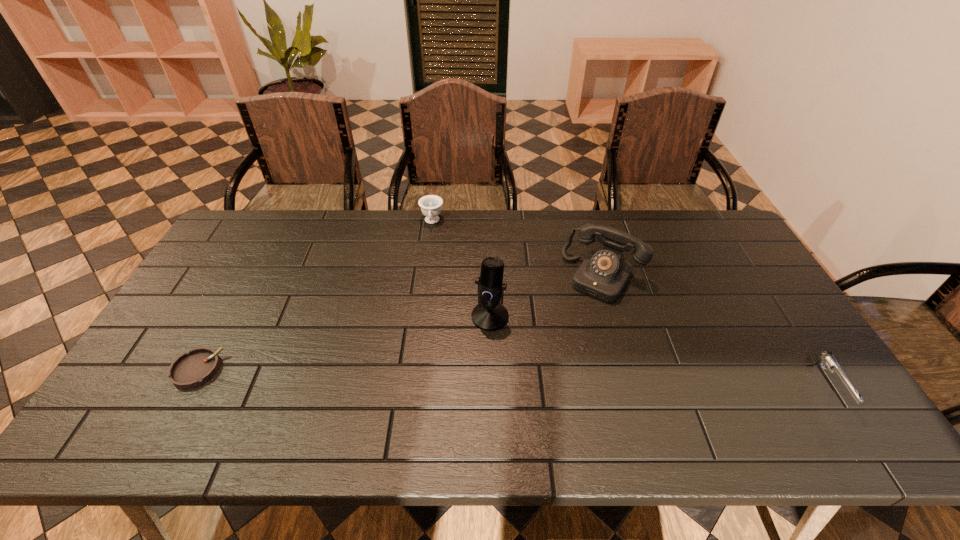
Locate an element on the screen. free spot located 0.290m on the dial of the second tallest object is located at coordinates (544, 369).

I want to click on free space located 0.330m on the dial of the second tallest object, so click(x=537, y=380).

In order to click on vacant area situated 0.090m on the dial of the second tallest object in this screenshot , I will do [x=576, y=319].

You are a GUI agent. You are given a task and a screenshot of the screen. Output one action in this format:
    pyautogui.click(x=<x>, y=<y>)
    Task: Click on the vacant space situated on the stand of the tallest object
    This screenshot has height=540, width=960.
    Given the screenshot: What is the action you would take?
    pyautogui.click(x=455, y=363)

This screenshot has width=960, height=540. I want to click on vacant space located 0.080m on the stand of the tallest object, so click(x=466, y=349).

Locate an element on the screen. The width and height of the screenshot is (960, 540). vacant space located on the stand of the tallest object is located at coordinates (443, 380).

Image resolution: width=960 pixels, height=540 pixels. I want to click on free spot located on the side of the second object from left to right with the handle, so click(x=421, y=314).

At what (x,y) coordinates should I click in order to perform the action: click on free location located on the side of the second object from left to right with the handle. Please return your answer as a coordinate pair (x, y). The image size is (960, 540). Looking at the image, I should click on (425, 280).

The width and height of the screenshot is (960, 540). Find the location of `blank area located on the side of the second object from left to right with the handle`. blank area located on the side of the second object from left to right with the handle is located at coordinates (424, 289).

I want to click on telephone at the far edge, so click(x=603, y=274).